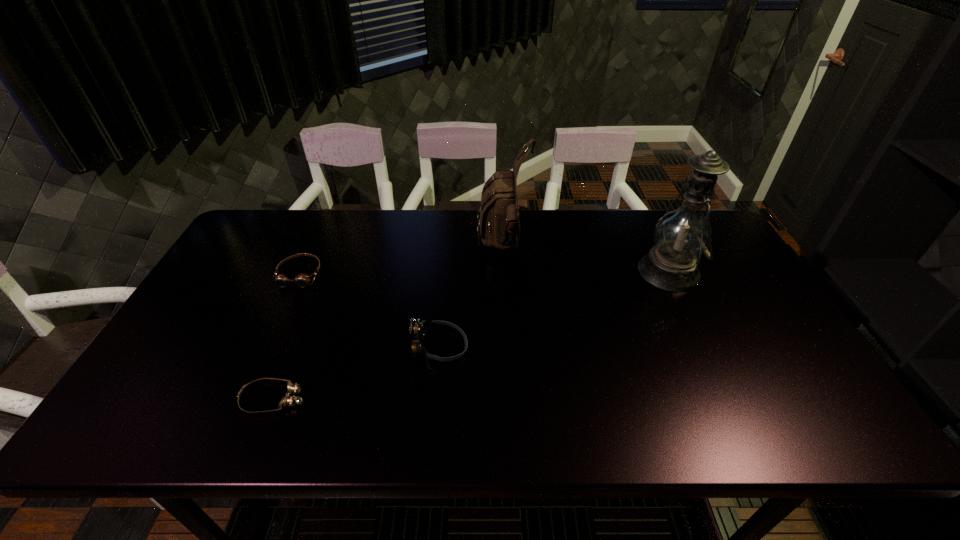
You are a GUI agent. You are given a task and a screenshot of the screen. Output one action in this format:
    pyautogui.click(x=<x>, y=<y>)
    Task: Click on the free spot between the shortest goggles and the fourth shortest object
    This screenshot has height=540, width=960.
    Given the screenshot: What is the action you would take?
    pyautogui.click(x=389, y=322)

You are a GUI agent. You are given a task and a screenshot of the screen. Output one action in this format:
    pyautogui.click(x=<x>, y=<y>)
    Task: Click on the free space between the second nearest goggles and the oil lamp
    Image resolution: width=960 pixels, height=540 pixels.
    Given the screenshot: What is the action you would take?
    pyautogui.click(x=554, y=309)

You are a GUI agent. You are given a task and a screenshot of the screen. Output one action in this format:
    pyautogui.click(x=<x>, y=<y>)
    Task: Click on the free space between the third tallest object and the oil lamp
    The width and height of the screenshot is (960, 540).
    Given the screenshot: What is the action you would take?
    pyautogui.click(x=554, y=309)

At what (x,y) coordinates should I click in order to perform the action: click on free space between the tallest object and the third shortest object. Please return your answer as a coordinate pair (x, y). Looking at the image, I should click on (554, 309).

Find the location of a particular element. unoccupied area between the nearest object and the tallest object is located at coordinates (471, 335).

Find the location of a particular element. free space between the second shortest goggles and the shortest goggles is located at coordinates (287, 336).

Find the location of a particular element. The width and height of the screenshot is (960, 540). empty space between the nearest goggles and the second shortest goggles is located at coordinates (287, 336).

Where is `object that can be found as the third closest to the second shortest goggles`? object that can be found as the third closest to the second shortest goggles is located at coordinates (498, 221).

The image size is (960, 540). What are the coordinates of `object that is the second nearest to the tallest object` in the screenshot? It's located at (420, 328).

What are the coordinates of `goggles that stands as the closest to the rightmost goggles` in the screenshot? It's located at (x=288, y=400).